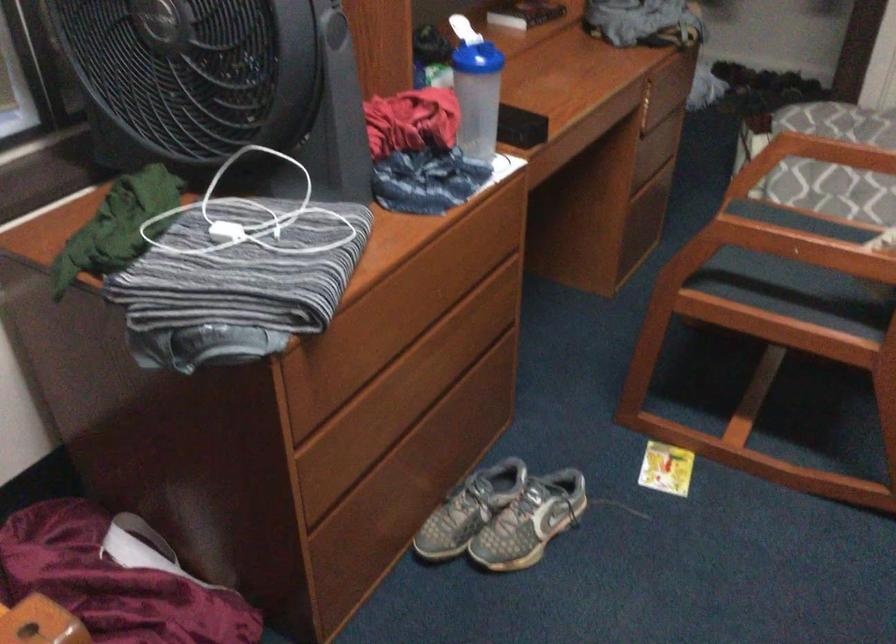
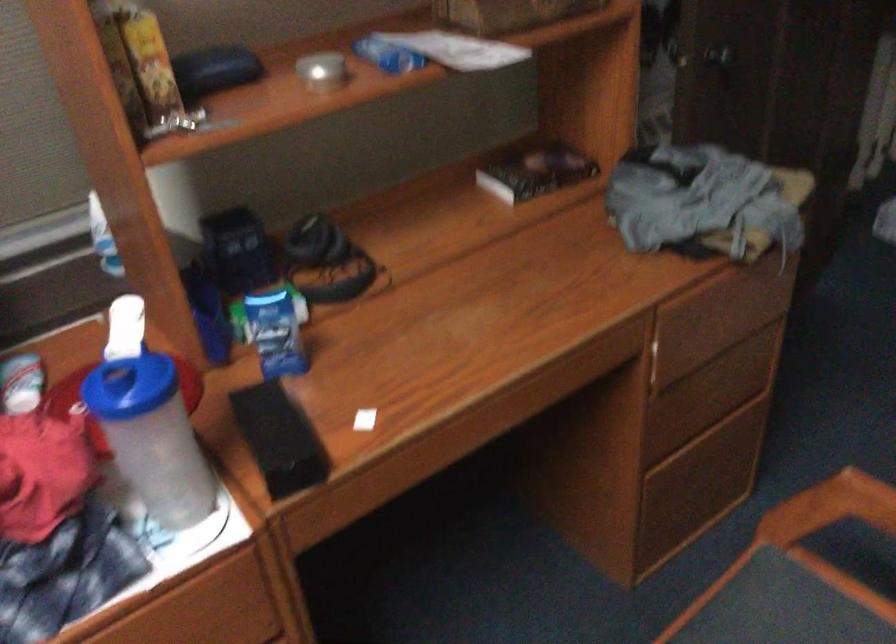
Find the pixel in the second image that matches point (755, 216) in the first image.

(780, 614)